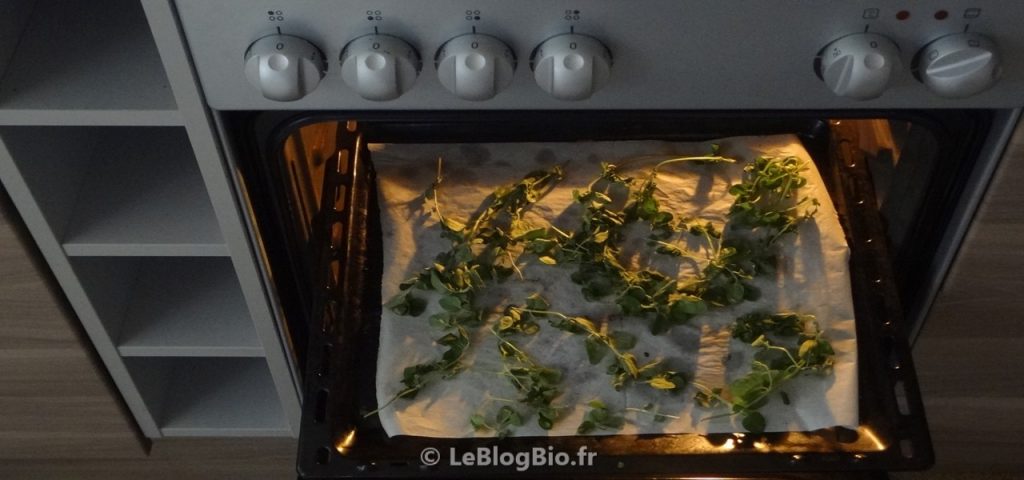
At what (x,y) coordinates should I click in order to perform the action: click on oven. Please return your answer as a coordinate pair (x, y). Looking at the image, I should click on (640, 102).